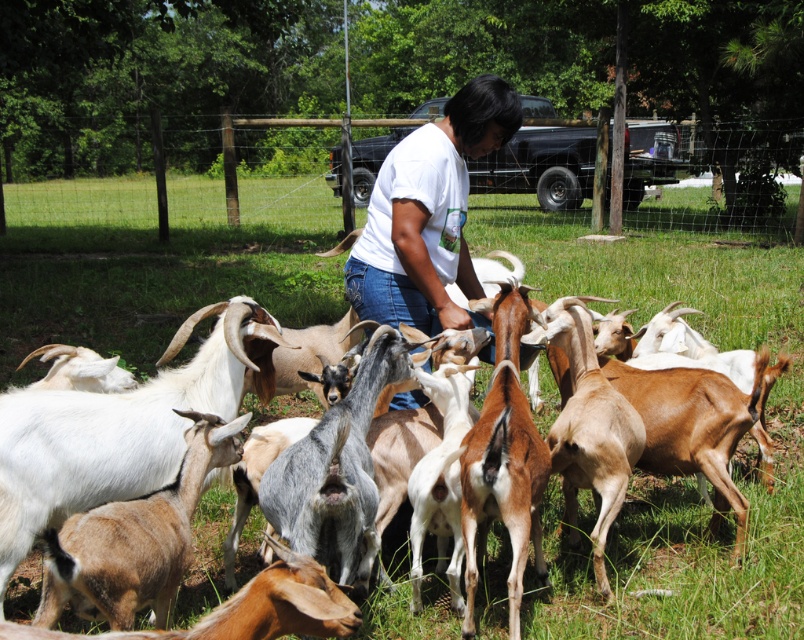
You are a farmer trying to determine which item in the scene takes up more space visually. You see the green grass at center and the white cotton shirt at center. Which one appears bigger?

The green grass at center has a larger size compared to the white cotton shirt at center, so the green grass at center appears bigger.

What is the exact coordinate of the green grass at center in the image?

The green grass at center is located at point (671,477).